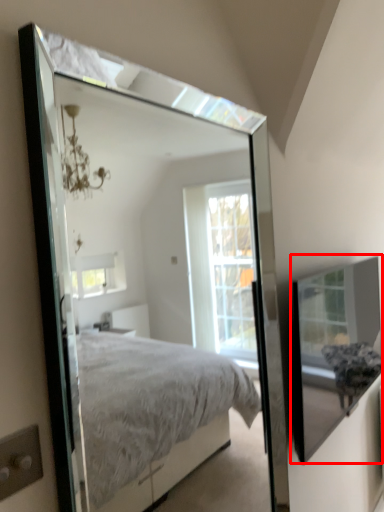
Question: Considering the relative positions of glass box (annotated by the red box) and mirror in the image provided, where is glass box (annotated by the red box) located with respect to the staircase?

Choices:
 (A) right
 (B) left

Answer: (A)